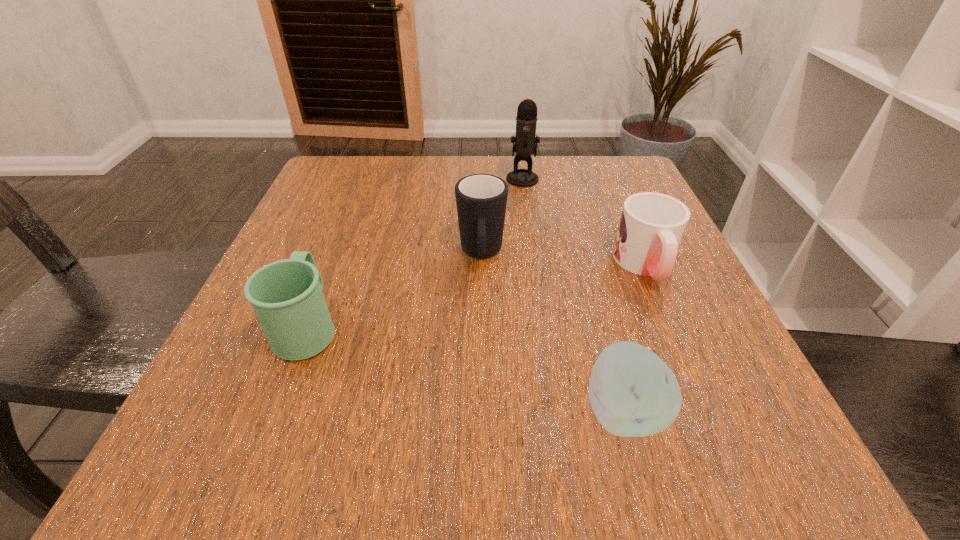
Image resolution: width=960 pixels, height=540 pixels. Identify the location of vacant space located on the side of the leftmost object with the handle. [x=354, y=207].

Where is `blank area located 0.210m on the side of the leftmost object with the handle`? The width and height of the screenshot is (960, 540). blank area located 0.210m on the side of the leftmost object with the handle is located at coordinates (348, 223).

Locate an element on the screen. free spot located on the left of the nearest object is located at coordinates (323, 411).

I want to click on free space located 0.140m on the side of the rightmost mug with the handle, so click(686, 361).

Locate an element on the screen. The height and width of the screenshot is (540, 960). object located in the far edge section of the desktop is located at coordinates (526, 140).

Where is `object at the near edge`? The width and height of the screenshot is (960, 540). object at the near edge is located at coordinates (633, 393).

What are the coordinates of `object that is at the left edge` in the screenshot? It's located at (287, 297).

The height and width of the screenshot is (540, 960). In order to click on apple that is positioned at the right edge in this screenshot , I will do `click(633, 393)`.

Locate an element on the screen. Image resolution: width=960 pixels, height=540 pixels. mug positioned at the right edge is located at coordinates (652, 225).

I want to click on object present at the near right corner, so click(x=633, y=393).